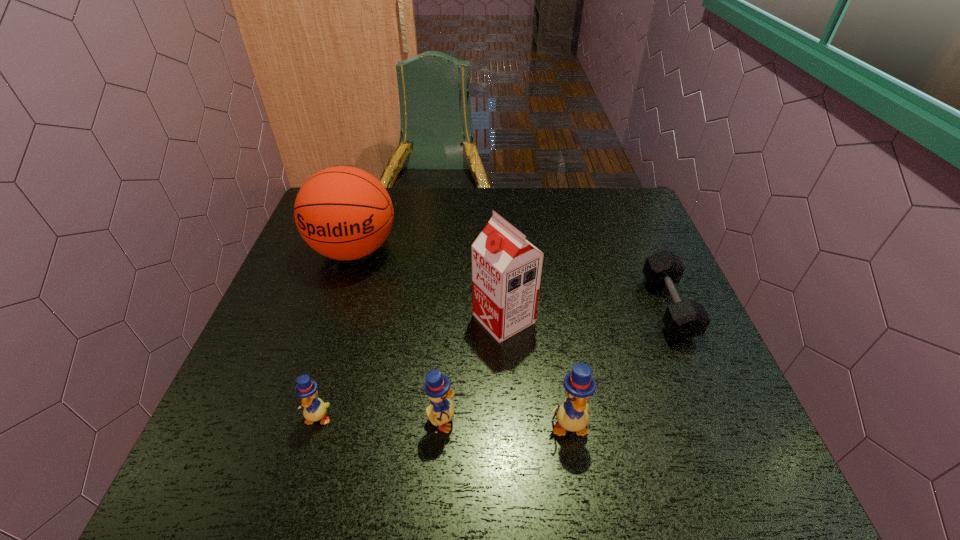
At what (x,y) coordinates should I click in order to perform the action: click on free space between the shortest duckling and the third object from right to left. Please return your answer as a coordinate pair (x, y). This screenshot has height=540, width=960. Looking at the image, I should click on (411, 368).

Identify which object is the second nearest to the second shortest object. Please provide its 2D coordinates. Your answer should be formatted as a tuple, i.e. [(x, y)], where the tuple contains the x and y coordinates of a point satisfying the conditions above.

[(506, 268)]

The image size is (960, 540). I want to click on object that can be found as the fourth closest to the rightmost duckling, so click(x=314, y=409).

Identify which duckling is located as the nearest to the leftmost duckling. Please provide its 2D coordinates. Your answer should be formatted as a tuple, i.e. [(x, y)], where the tuple contains the x and y coordinates of a point satisfying the conditions above.

[(437, 387)]

In order to click on duckling that stands as the closest to the basketball in this screenshot , I will do `click(314, 409)`.

I want to click on vacant space that satisfies the following two spatial constraints: 1. on the side with logo of the basketball; 2. on the right side of the rightmost object, so click(335, 307).

You are a GUI agent. You are given a task and a screenshot of the screen. Output one action in this format:
    pyautogui.click(x=<x>, y=<y>)
    Task: Click on the vacant space that satisfies the following two spatial constraints: 1. on the front side of the rightmost object; 2. on the face of the second shortest duckling, where the monocle is placed
    This screenshot has width=960, height=540.
    Given the screenshot: What is the action you would take?
    pyautogui.click(x=717, y=421)